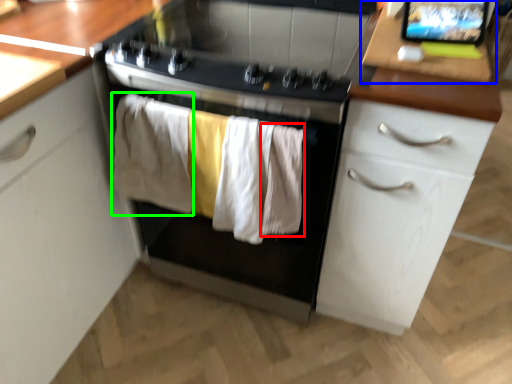
Question: Which object is positioned farthest from clothing (highlighted by a red box)? Select from table (highlighted by a blue box) and clothing (highlighted by a green box).

Choices:
 (A) table
 (B) clothing

Answer: (A)